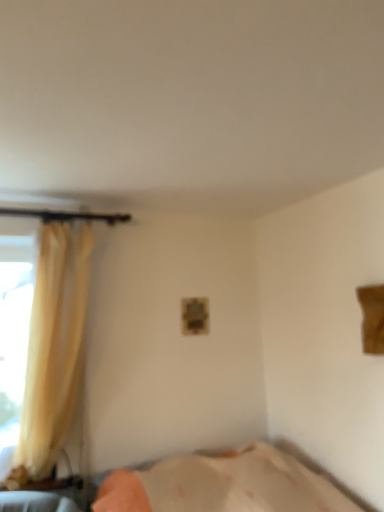
This screenshot has height=512, width=384. Describe the element at coordinates (244, 479) in the screenshot. I see `beige fabric bed at lower center` at that location.

In order to face beige fabric bed at lower center, should I rotate leftwards or rightwards?

Turn right by 5.294 degrees to look at beige fabric bed at lower center.

Where is `beige fabric bed at lower center`? Image resolution: width=384 pixels, height=512 pixels. beige fabric bed at lower center is located at coordinates click(244, 479).

What do you see at coordinates (55, 345) in the screenshot? I see `silky yellow curtain at left` at bounding box center [55, 345].

In order to face silky yellow curtain at left, should I rotate leftwards or rightwards?

You should rotate left by 18.665 degrees.

Where is `silky yellow curtain at left`? This screenshot has height=512, width=384. silky yellow curtain at left is located at coordinates (55, 345).

At what (x,y) coordinates should I click in order to perform the action: click on beige fabric bed at lower center. Please return your answer as a coordinate pair (x, y). This screenshot has height=512, width=384. Looking at the image, I should click on tap(244, 479).

Is beige fabric bed at lower center to the right of silky yellow curtain at left from the viewer's perspective?

Yes.

Which is in front, beige fabric bed at lower center or silky yellow curtain at left?

beige fabric bed at lower center.

Which point is more distant from viewer, (309,460) or (22,444)?

Point (309,460)

From the image's perspective, is beige fabric bed at lower center positioned above or below silky yellow curtain at left?

Clearly, from the image's perspective, beige fabric bed at lower center is below silky yellow curtain at left.

From a real-world perspective, is beige fabric bed at lower center physically above silky yellow curtain at left?

No, from a real-world perspective, beige fabric bed at lower center is not on top of silky yellow curtain at left.

In terms of width, does beige fabric bed at lower center look wider or thinner when compared to silky yellow curtain at left?

Considering their sizes, beige fabric bed at lower center looks broader than silky yellow curtain at left.

Between beige fabric bed at lower center and silky yellow curtain at left, which one has less height?

Standing shorter between the two is beige fabric bed at lower center.

Considering the relative sizes of beige fabric bed at lower center and silky yellow curtain at left in the image provided, is beige fabric bed at lower center bigger than silky yellow curtain at left?

Yes.

Is beige fabric bed at lower center inside or outside of silky yellow curtain at left?

beige fabric bed at lower center is located beyond the bounds of silky yellow curtain at left.

Is beige fabric bed at lower center not close to silky yellow curtain at left?

beige fabric bed at lower center is far away from silky yellow curtain at left.

Is silky yellow curtain at left at the back of beige fabric bed at lower center?

That's not correct — beige fabric bed at lower center is not looking away from silky yellow curtain at left.

Identify the location of curtain on the left of beige fabric bed at lower center. (55, 345).

Considering the relative positions of silky yellow curtain at left and beige fabric bed at lower center in the image provided, is silky yellow curtain at left to the left or to the right of beige fabric bed at lower center?

Clearly, silky yellow curtain at left is on the left of beige fabric bed at lower center in the image.

Is silky yellow curtain at left positioned before beige fabric bed at lower center?

No, silky yellow curtain at left is behind beige fabric bed at lower center.

Is point (49, 238) positioned in front of point (155, 507)?

No, (49, 238) is further to viewer.

From the image's perspective, would you say silky yellow curtain at left is shown under beige fabric bed at lower center?

No, from the image's perspective, silky yellow curtain at left is not below beige fabric bed at lower center.

From a real-world perspective, is silky yellow curtain at left positioned under beige fabric bed at lower center based on gravity?

No, from a real-world perspective, silky yellow curtain at left is not below beige fabric bed at lower center.

Considering the sizes of objects silky yellow curtain at left and beige fabric bed at lower center in the image provided, who is wider, silky yellow curtain at left or beige fabric bed at lower center?

Wider between the two is beige fabric bed at lower center.

Who is taller, silky yellow curtain at left or beige fabric bed at lower center?

With more height is silky yellow curtain at left.

From the picture: Considering the relative sizes of silky yellow curtain at left and beige fabric bed at lower center in the image provided, is silky yellow curtain at left bigger than beige fabric bed at lower center?

Actually, silky yellow curtain at left might be smaller than beige fabric bed at lower center.

Does silky yellow curtain at left contain beige fabric bed at lower center?

No, silky yellow curtain at left does not contain beige fabric bed at lower center.

Is silky yellow curtain at left beside beige fabric bed at lower center?

No, silky yellow curtain at left is not beside beige fabric bed at lower center.

Is silky yellow curtain at left facing towards beige fabric bed at lower center?

No, silky yellow curtain at left is not facing towards beige fabric bed at lower center.

How many degrees apart are the facing directions of silky yellow curtain at left and beige fabric bed at lower center?

They differ by 88.6 degrees in their facing directions.

There is a beige fabric bed at lower center. At what (x,y) coordinates should I click in order to perform the action: click on curtain above it (from a real-world perspective). Please return your answer as a coordinate pair (x, y). The width and height of the screenshot is (384, 512). Looking at the image, I should click on (55, 345).

At what (x,y) coordinates should I click in order to perform the action: click on bed in front of the silky yellow curtain at left. Please return your answer as a coordinate pair (x, y). Looking at the image, I should click on (244, 479).

The width and height of the screenshot is (384, 512). In order to click on curtain behind the beige fabric bed at lower center in this screenshot , I will do (x=55, y=345).